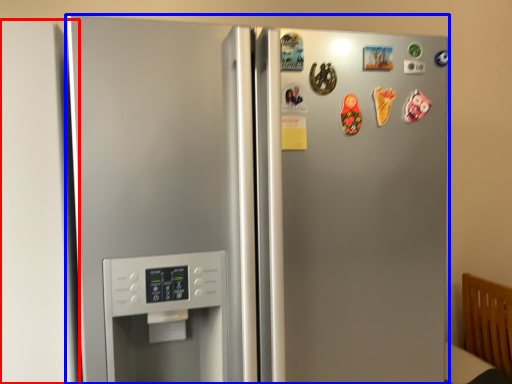
Question: Which of the following is the closest to the observer, door (highlighted by a red box) or refrigerator (highlighted by a blue box)?

Choices:
 (A) door
 (B) refrigerator

Answer: (B)